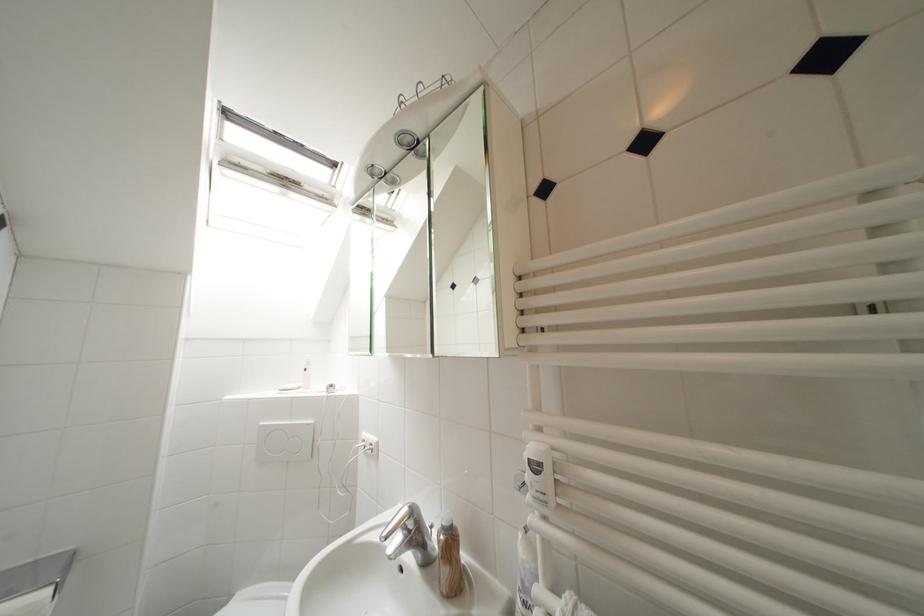
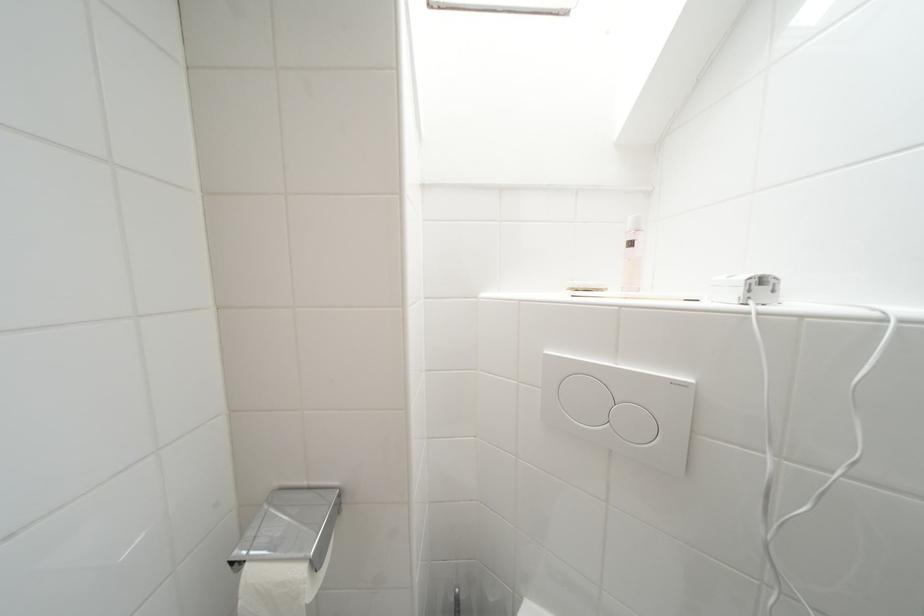
Where in the second image is the point corresponding to point 311,373 from the first image?

(638, 246)